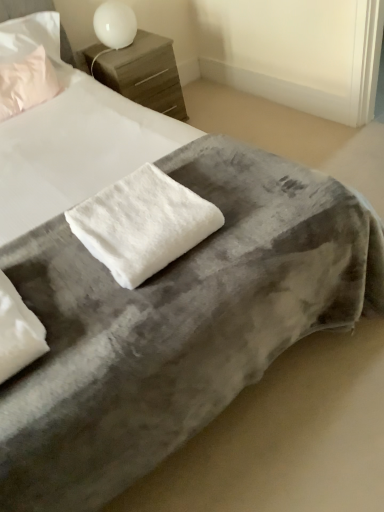
At what (x,y) coordinates should I click in order to perform the action: click on free space on the front side of white fluffy towel at center. Please return your answer as a coordinate pair (x, y). Looking at the image, I should click on (141, 308).